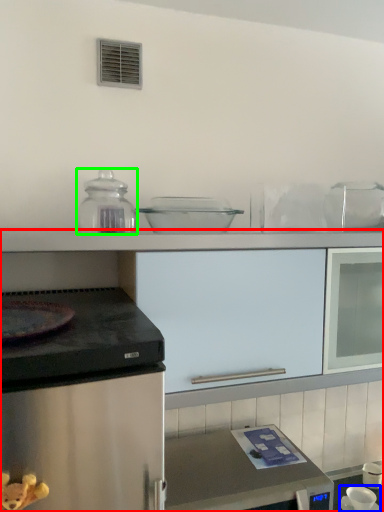
Question: Which object is the farthest from cabinetry (highlighted by a red box)? Choose among these: appliance (highlighted by a blue box) or kitchen appliance (highlighted by a green box).

Choices:
 (A) appliance
 (B) kitchen appliance

Answer: (A)